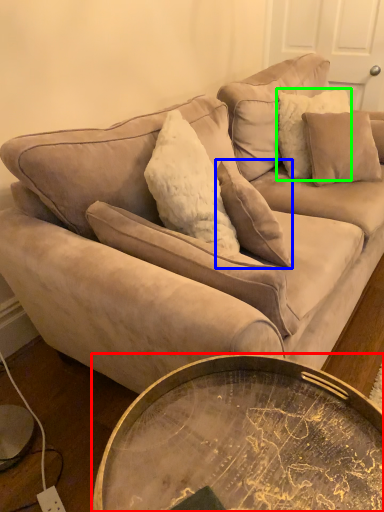
Question: Which is nearer to the coffee table (highlighted by a red box)? pillow (highlighted by a blue box) or pillow (highlighted by a green box).

Choices:
 (A) pillow
 (B) pillow

Answer: (A)